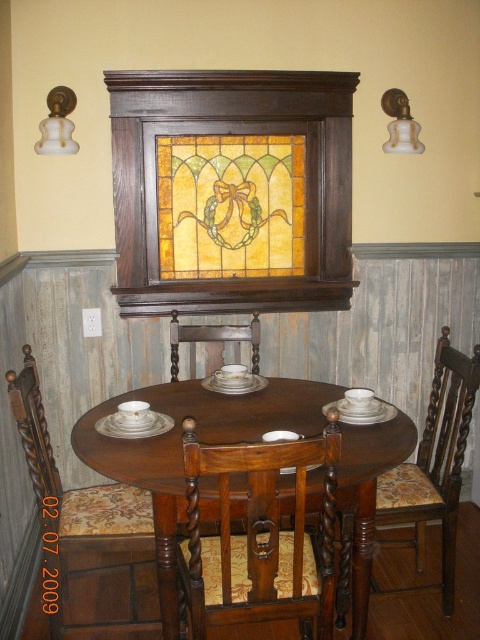
You are planning to hang a new painting in the dining area. The current stained glass at center is above the floral fabric chair at lower left. Where should you place the new painting so it doesn

The new painting should be placed below the stained glass at center to avoid blocking the view from the floral fabric chair at lower left.

You are planning to hang a new painting above the round wooden table. The painting is 1.2 meters tall. The stained glass at center is currently above the table. Can the painting be placed above the table without overlapping the floral fabric chair at lower left?

The stained glass at center is shorter than the floral fabric chair at lower left. Since the painting is 1.2 meters tall and the stained glass is shorter than the chair, there might be enough vertical space above the table to hang the painting without overlapping the chair. However, exact dimensions of the table and chair are needed for precise placement.

You are sitting at the dining area and want to look at the stained glass at center. Which direction should you turn your head to see it from the floral fabric chair at lower left?

You should turn your head to the right to see the stained glass at center, as it is located to the right of the floral fabric chair at lower left.